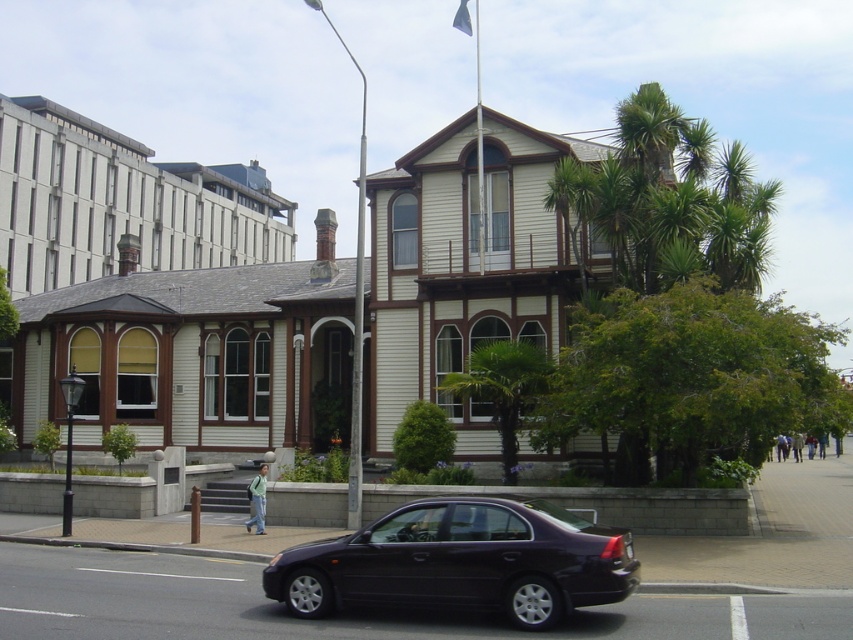
Please describe the position of the satin black sedan at center in the image using the coordinate system where the bottom left corner is the origin point. The coordinates are given as a pair of values between 0 and 1, representing the horizontal and vertical positions respectively. The horizontal axis goes from left to right, and the vertical axis goes from bottom to top. The coordinates provided are for the center of the object. Is the sedan closer to the bottom or top of the image?

The satin black sedan at center is located at coordinates approximately 0.878 on the horizontal axis and 0.542 on the vertical axis. Since the vertical coordinate is 0.542, which is above the midpoint of 0.5, the sedan is closer to the top of the image.

In the scene shown: You are standing at the point marked by the coordinates point [461,561] in the image. What object are you facing?

The point [461,561] marks the satin black sedan at center, so you are facing the satin black sedan at center.